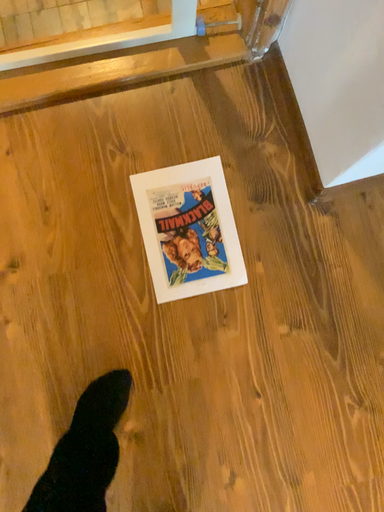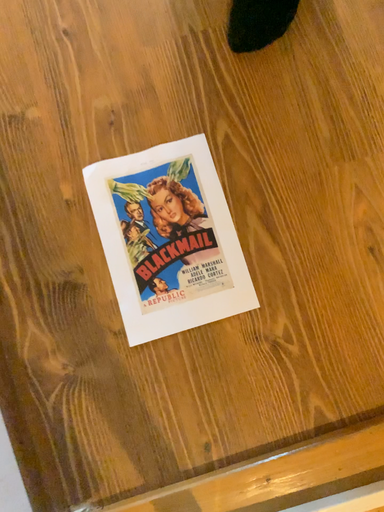
Question: Which way did the camera rotate in the video?

Choices:
 (A) rotated upward
 (B) rotated downward

Answer: (A)